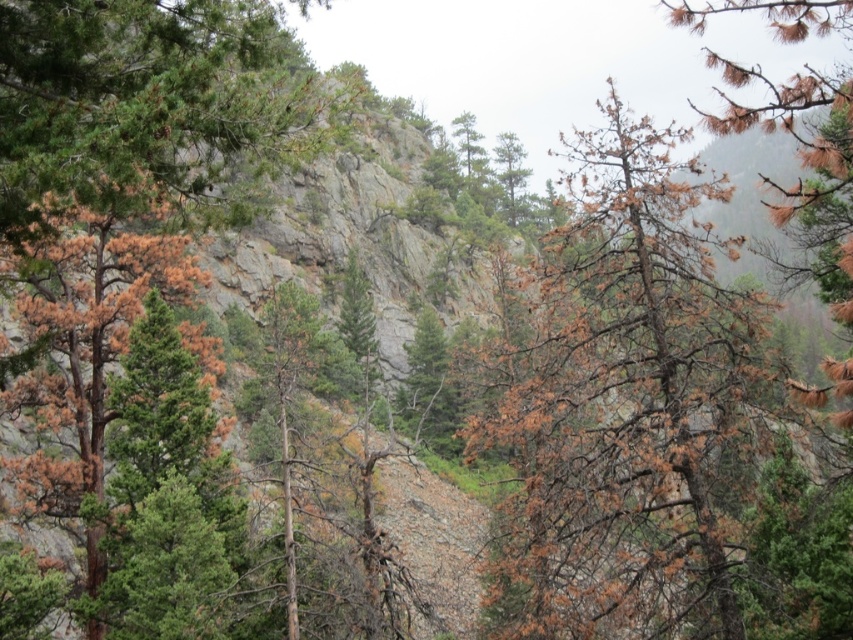
Question: Which object is closer to the camera taking this photo?

Choices:
 (A) green matte tree at upper left
 (B) brown/dried needles at right
 (C) brown textured tree at left

Answer: (A)

Question: Among these objects, which one is farthest from the camera?

Choices:
 (A) green matte tree at upper left
 (B) brown/dried needles at right

Answer: (B)

Question: Does green matte tree at upper left appear over brown textured tree at left?

Choices:
 (A) yes
 (B) no

Answer: (A)

Question: Among these points, which one is nearest to the camera?

Choices:
 (A) (33, 365)
 (B) (631, 362)

Answer: (A)

Question: Can you confirm if brown/dried needles at right is positioned to the right of green matte tree at upper left?

Choices:
 (A) no
 (B) yes

Answer: (B)

Question: Is brown/dried needles at right positioned at the back of green matte tree at upper left?

Choices:
 (A) no
 (B) yes

Answer: (B)